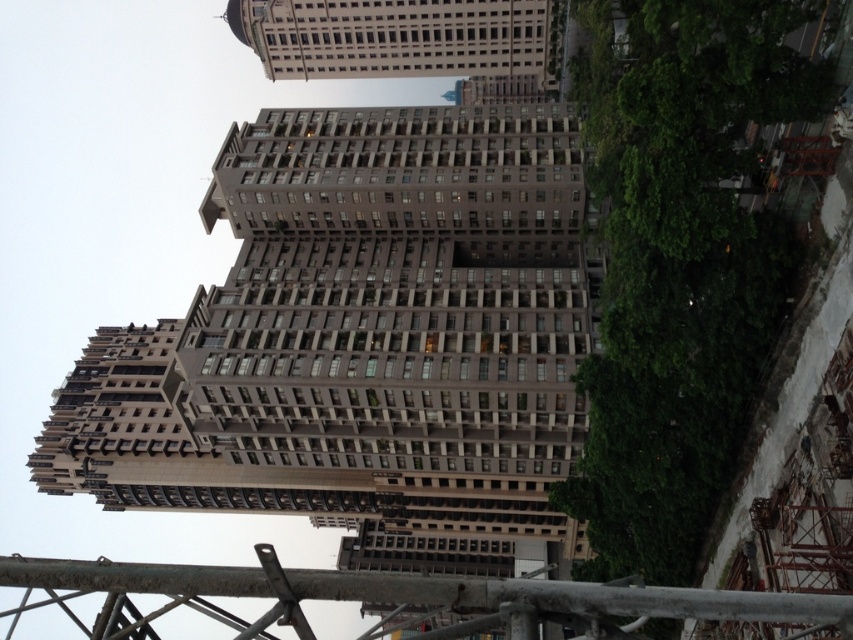
Can you confirm if metallic scaffolding at center is positioned below beige stone building at upper center?

Correct, metallic scaffolding at center is located below beige stone building at upper center.

Does point (590, 586) come in front of point (463, 33)?

Yes, point (590, 586) is in front of point (463, 33).

Where is `metallic scaffolding at center`? metallic scaffolding at center is located at coordinates (408, 596).

I want to click on metallic scaffolding at center, so coord(408,596).